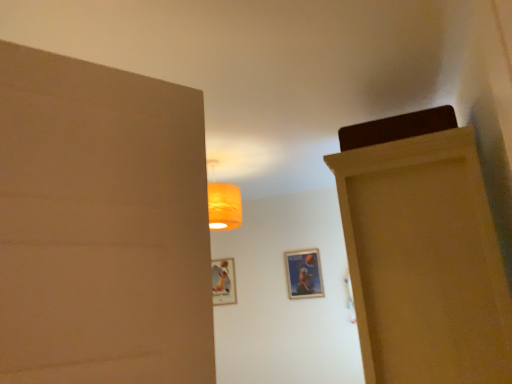
Question: Is wooden door at right wider or thinner than matte plastic picture frame at center, which is the second picture frame in front-to-back order?

Choices:
 (A) wide
 (B) thin

Answer: (A)

Question: Is wooden door at right situated inside matte plastic picture frame at center, the second picture frame positioned from the right, or outside?

Choices:
 (A) inside
 (B) outside

Answer: (B)

Question: Which is nearer to the matte plastic picture frame at center, arranged as the 1th picture frame when viewed from the back?

Choices:
 (A) metallic silver picture frame at center, which ranks as the first picture frame in front-to-back order
 (B) wooden door at right

Answer: (A)

Question: Based on their relative distances, which object is farther from the matte plastic picture frame at center, which is the second picture frame in front-to-back order?

Choices:
 (A) metallic silver picture frame at center, arranged as the first picture frame when viewed from the right
 (B) wooden door at right

Answer: (B)